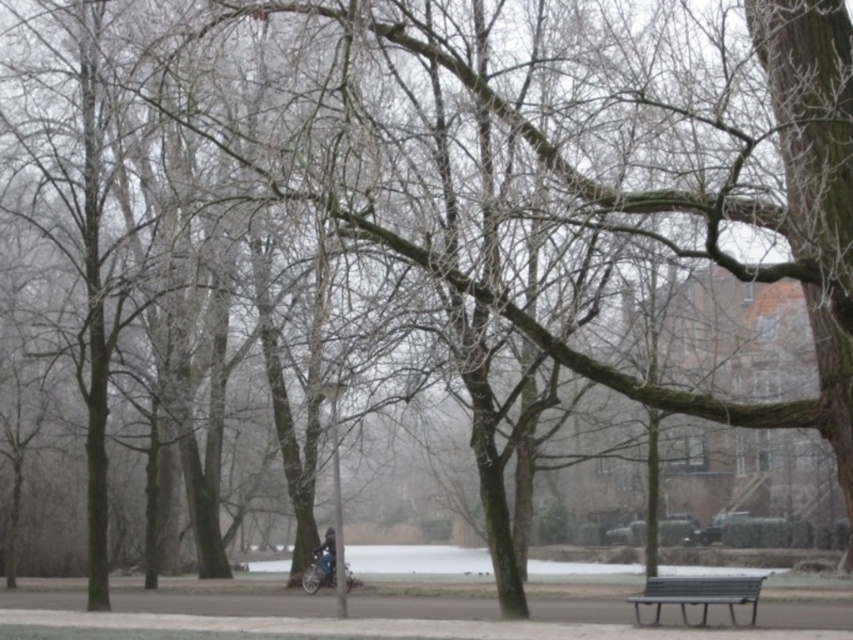
Question: Among these points, which one is nearest to the camera?

Choices:
 (A) (758, 589)
 (B) (334, 531)

Answer: (A)

Question: Can you confirm if metallic gray bench at lower right is positioned above dark blue jacket at center?

Choices:
 (A) yes
 (B) no

Answer: (B)

Question: Is metallic gray bench at lower right smaller than dark blue jacket at center?

Choices:
 (A) no
 (B) yes

Answer: (A)

Question: Which point is closer to the camera?

Choices:
 (A) (320, 556)
 (B) (689, 577)

Answer: (A)

Question: Which of the following is the closest to the observer?

Choices:
 (A) dark blue jacket at center
 (B) metallic gray bench at lower right

Answer: (B)

Question: Is metallic gray bench at lower right smaller than dark blue jacket at center?

Choices:
 (A) yes
 (B) no

Answer: (B)